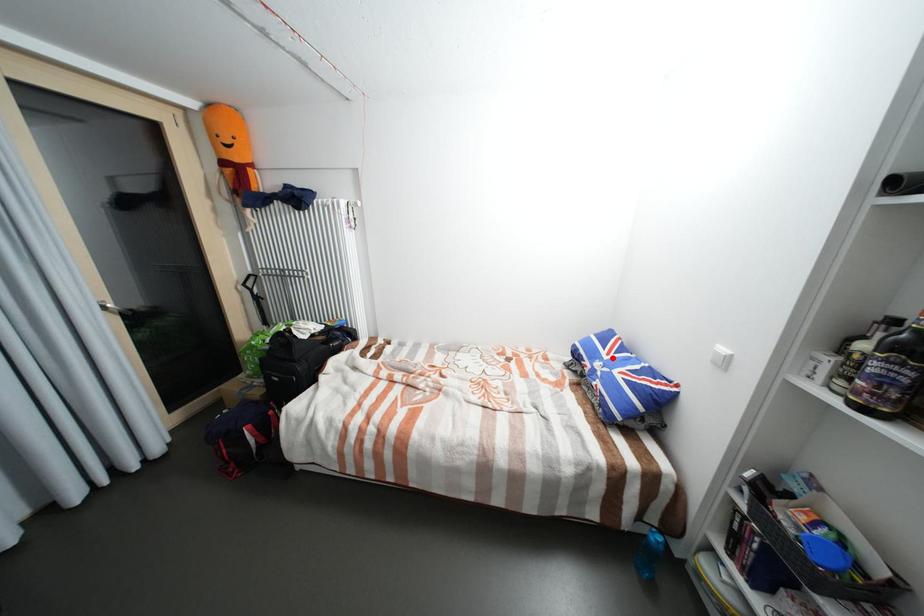
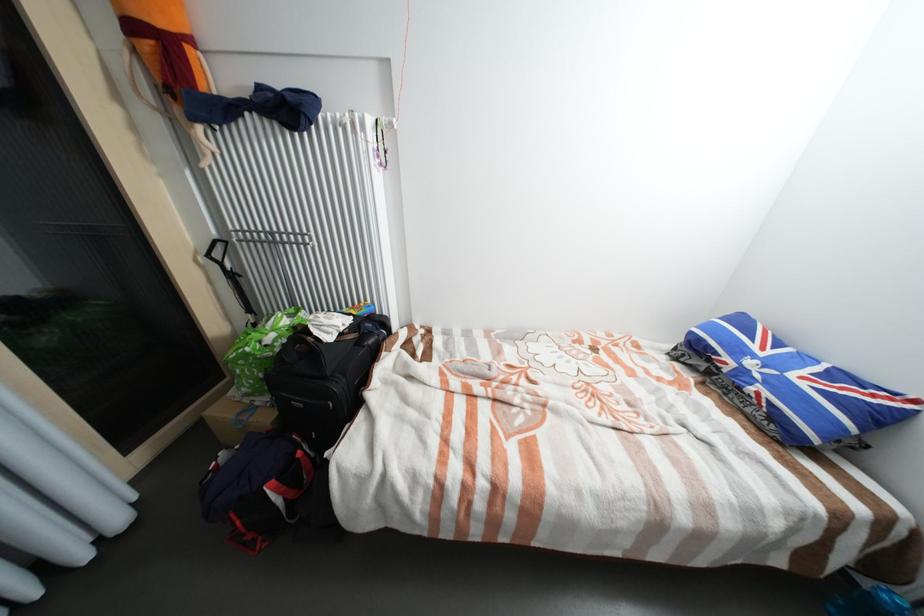
Find the pixel in the second image that matches the highlighted location in the first image.

(769, 354)